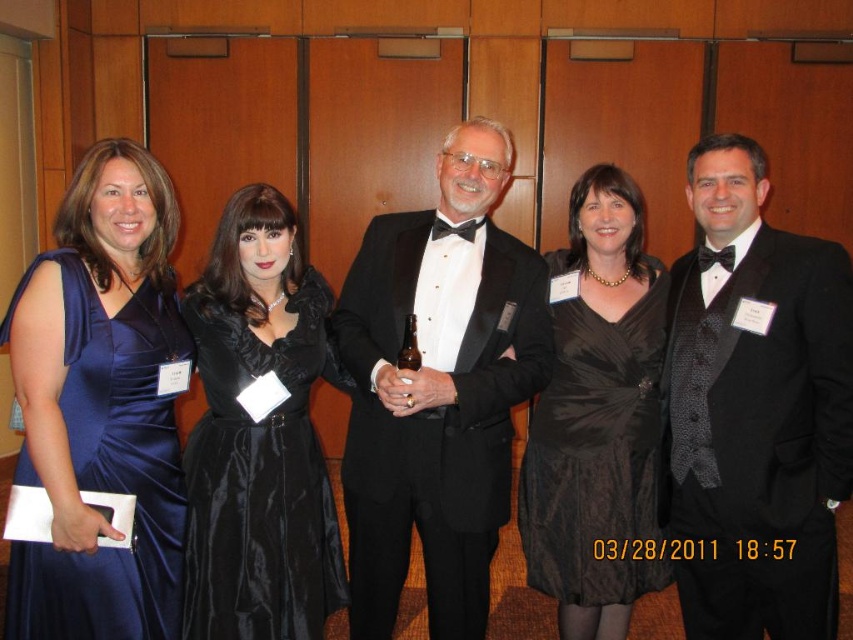
Question: Which of these objects is positioned closest to the black satin tuxedo at center?

Choices:
 (A) black satin suit at center
 (B) satin blue dress at left

Answer: (A)

Question: Estimate the real-world distances between objects in this image. Which object is closer to the black satin tuxedo at center?

Choices:
 (A) black satin dress at center
 (B) satin black dress at center
 (C) satin blue dress at left

Answer: (B)

Question: Is the position of black satin tuxedo at center less distant than that of black satin dress at center?

Choices:
 (A) yes
 (B) no

Answer: (A)

Question: Which of these objects is positioned farthest from the black satin dress at center?

Choices:
 (A) satin black dress at center
 (B) black satin suit at center
 (C) black satin tuxedo at center
 (D) satin blue dress at left

Answer: (D)

Question: Can you confirm if satin black dress at center is positioned below satin blue dress at left?

Choices:
 (A) no
 (B) yes

Answer: (B)

Question: Is black satin suit at center wider than satin black dress at center?

Choices:
 (A) yes
 (B) no

Answer: (B)